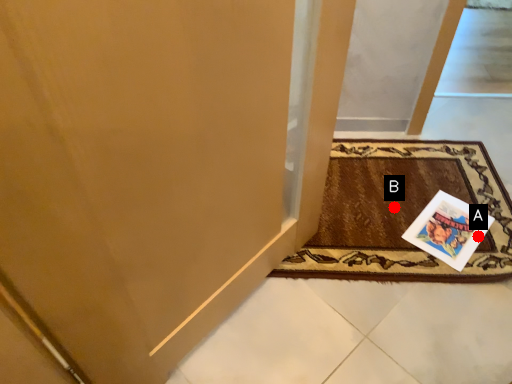
Question: Two points are circled on the image, labeled by A and B beside each circle. Which of the following is the closest to the observer?

Choices:
 (A) A is closer
 (B) B is closer

Answer: (A)